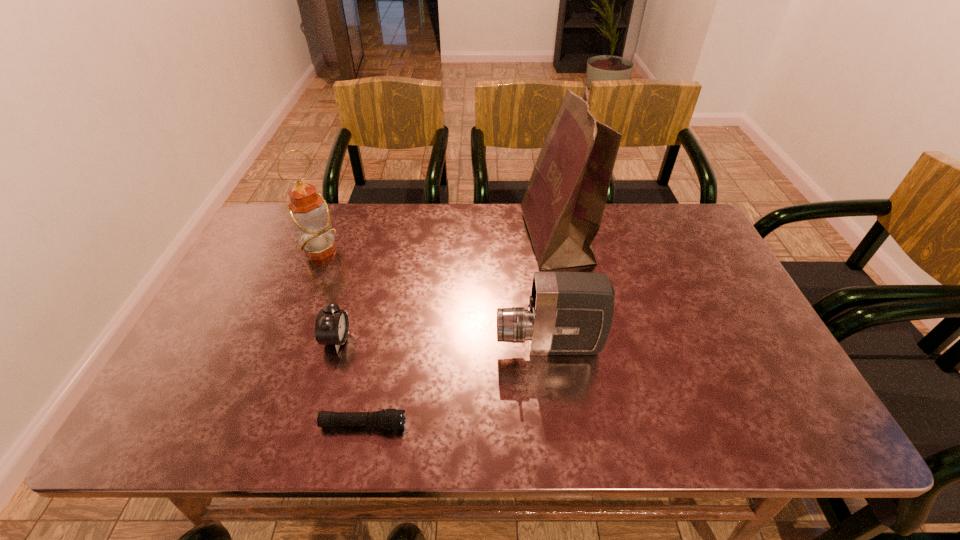
The width and height of the screenshot is (960, 540). In order to click on free space located on the right of the leftmost object in this screenshot , I will do `click(421, 251)`.

Image resolution: width=960 pixels, height=540 pixels. Identify the location of free space located at the front of the third shortest object, highlighting the lens. (338, 346).

Image resolution: width=960 pixels, height=540 pixels. Find the location of `vacant space positioned at the front of the third shortest object, highlighting the lens`. vacant space positioned at the front of the third shortest object, highlighting the lens is located at coordinates (431, 346).

Identify the location of vacant space situated at the front of the third shortest object, highlighting the lens. (383, 346).

I want to click on free space located 0.360m on the front side of the fourth tallest object, so click(492, 339).

Where is `free point located 0.050m at the lens end of the nearest object`? The image size is (960, 540). free point located 0.050m at the lens end of the nearest object is located at coordinates (429, 424).

I want to click on grocery bag located in the far edge section of the desktop, so click(x=563, y=206).

What are the coordinates of `oil lamp located in the far edge section of the desktop` in the screenshot? It's located at (309, 212).

Find the location of a particular element. The width and height of the screenshot is (960, 540). object located in the near edge section of the desktop is located at coordinates (387, 419).

This screenshot has width=960, height=540. In the image, there is a desktop. Identify the location of vacant space at the far edge. (632, 206).